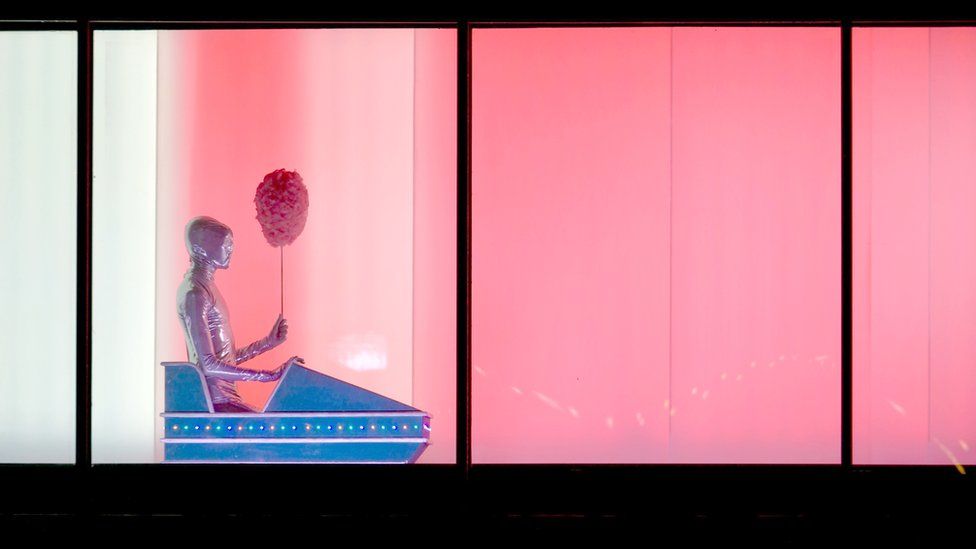
You are a GUI agent. You are given a task and a screenshot of the screen. Output one action in this format:
    pyautogui.click(x=<x>, y=<y>)
    Task: Click on the frame
    The image size is (976, 549).
    Given the screenshot: What is the action you would take?
    pyautogui.click(x=456, y=262)